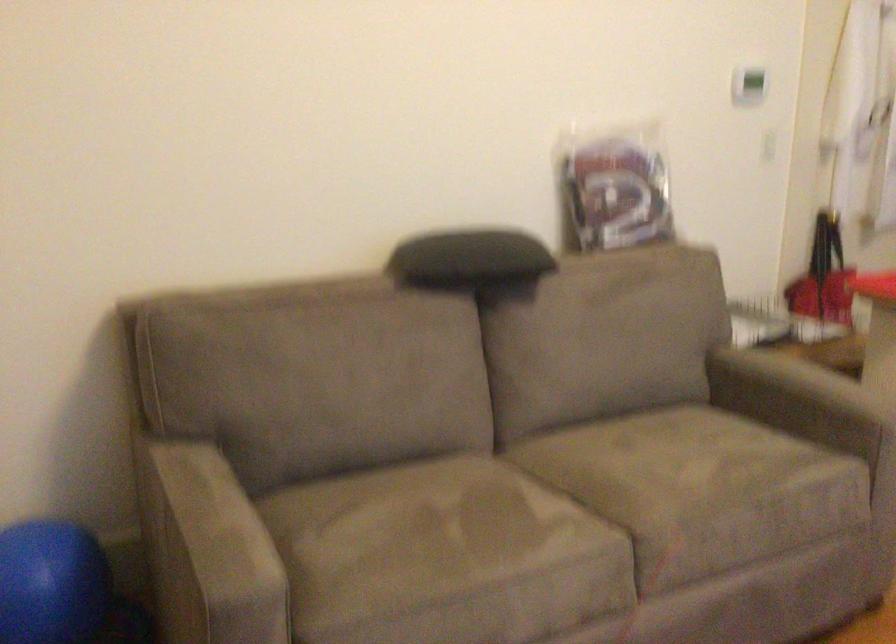
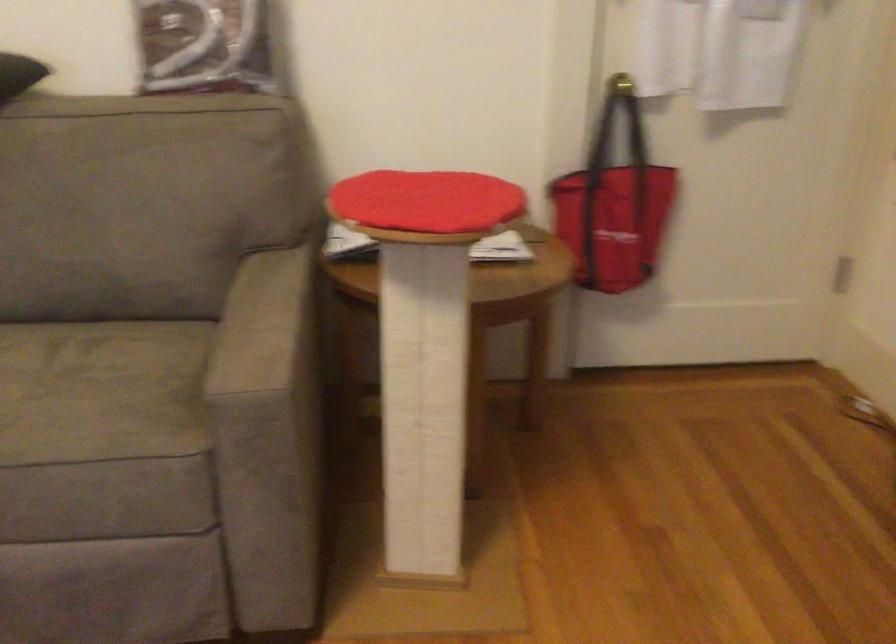
Where in the second image is the point corresponding to the point at 744,448 from the first image?

(101, 391)